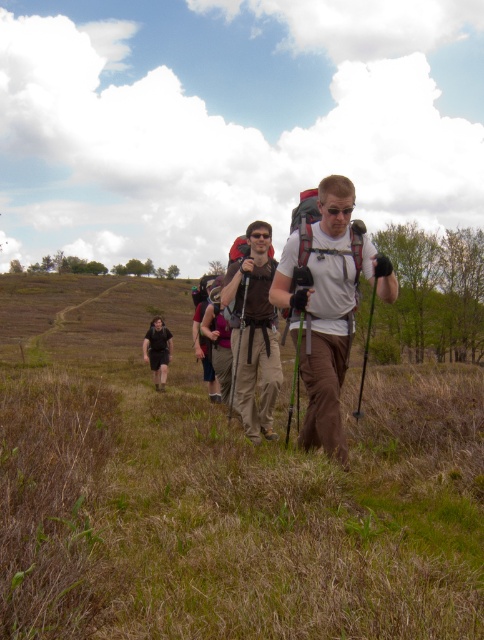
Who is lower down, white matte backpack at center or matte brown backpack at center?

matte brown backpack at center

Image resolution: width=484 pixels, height=640 pixels. What do you see at coordinates (328, 305) in the screenshot? I see `white matte backpack at center` at bounding box center [328, 305].

In order to click on white matte backpack at center in this screenshot , I will do `click(328, 305)`.

Measure the distance from brown dry grass at center to white matte backpack at center.

brown dry grass at center and white matte backpack at center are 4.24 meters apart from each other.

Which is behind, point (61, 374) or point (336, 237)?

Point (61, 374)

At what (x,y) coordinates should I click in order to perform the action: click on brown dry grass at center. Please return your answer as a coordinate pair (x, y). Looking at the image, I should click on (221, 488).

Who is lower down, matte brown backpack at center or black fabric pants at center?

black fabric pants at center is lower down.

Where is `matte brown backpack at center`? This screenshot has width=484, height=640. matte brown backpack at center is located at coordinates (254, 333).

Who is more distant from viewer, (245, 352) or (151, 324)?

The point (151, 324) is more distant.

Find the location of `matte brown backpack at center`. matte brown backpack at center is located at coordinates (254, 333).